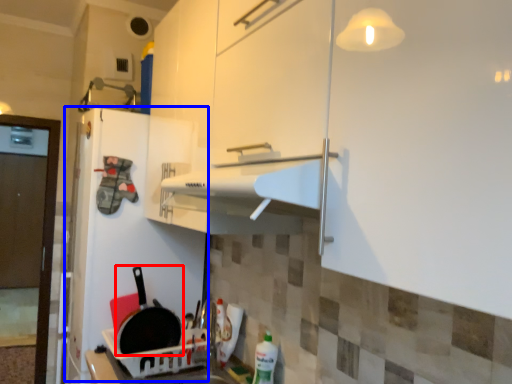
Question: Which point is closer to the camera, frying pan (highlighted by a red box) or fridge (highlighted by a blue box)?

Choices:
 (A) frying pan
 (B) fridge

Answer: (A)